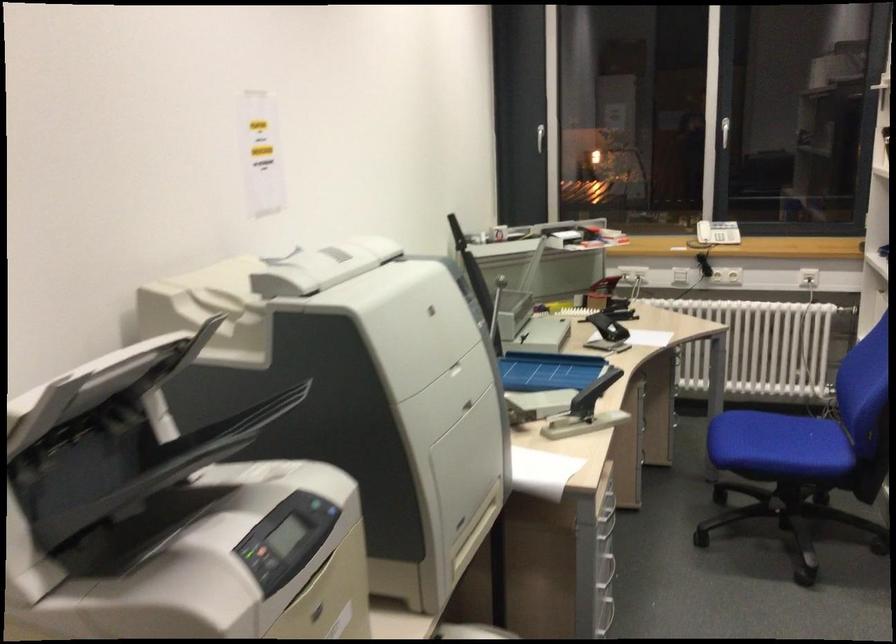
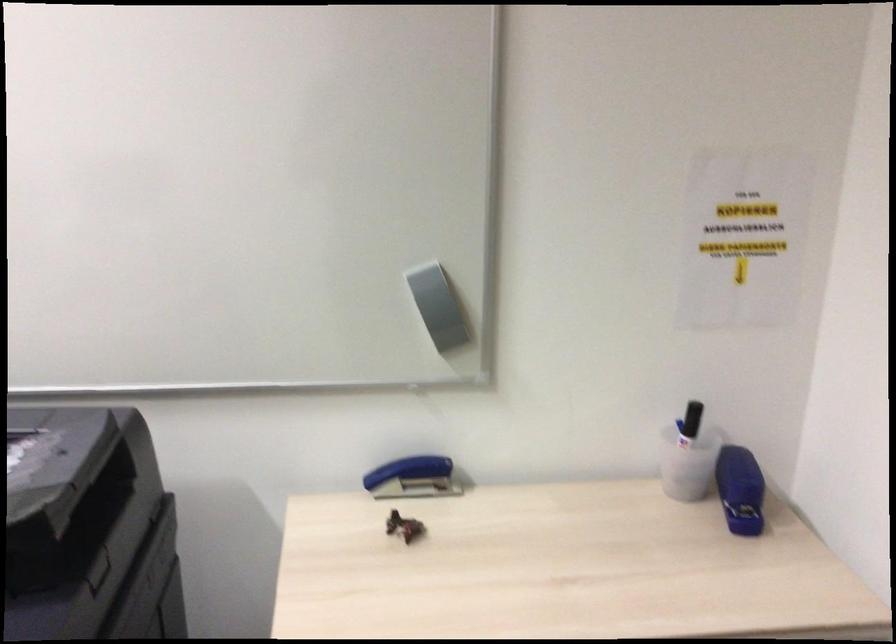
How did the camera likely rotate?

The rotation direction of the camera is right-down.